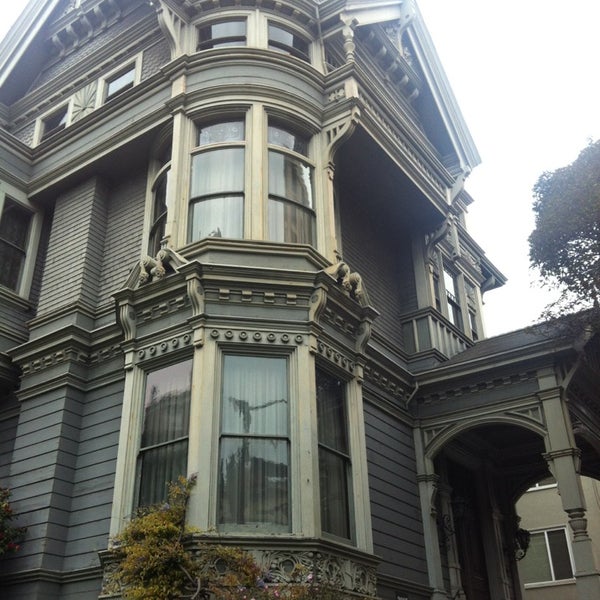
You are a GUI agent. You are given a task and a screenshot of the screen. Output one action in this format:
    pyautogui.click(x=<x>, y=<y>)
    Task: Click on the white window trim
    
    Given the screenshot: What is the action you would take?
    pyautogui.click(x=35, y=259)